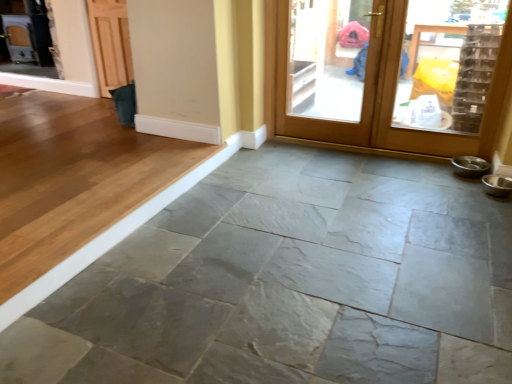
Question: Choose the correct answer: Is wooden screen door at upper right inside wooden door at upper right or outside it?

Choices:
 (A) outside
 (B) inside

Answer: (B)

Question: Looking at their shapes, would you say wooden screen door at upper right is wider or thinner than wooden door at upper right?

Choices:
 (A) wide
 (B) thin

Answer: (A)

Question: Estimate the real-world distances between objects in this image. Which object is farther from the wooden screen door at upper right?

Choices:
 (A) gray stone floor at center
 (B) wooden door at upper right

Answer: (A)

Question: Which object is positioned farthest from the gray stone floor at center?

Choices:
 (A) wooden screen door at upper right
 (B) wooden door at upper right

Answer: (A)